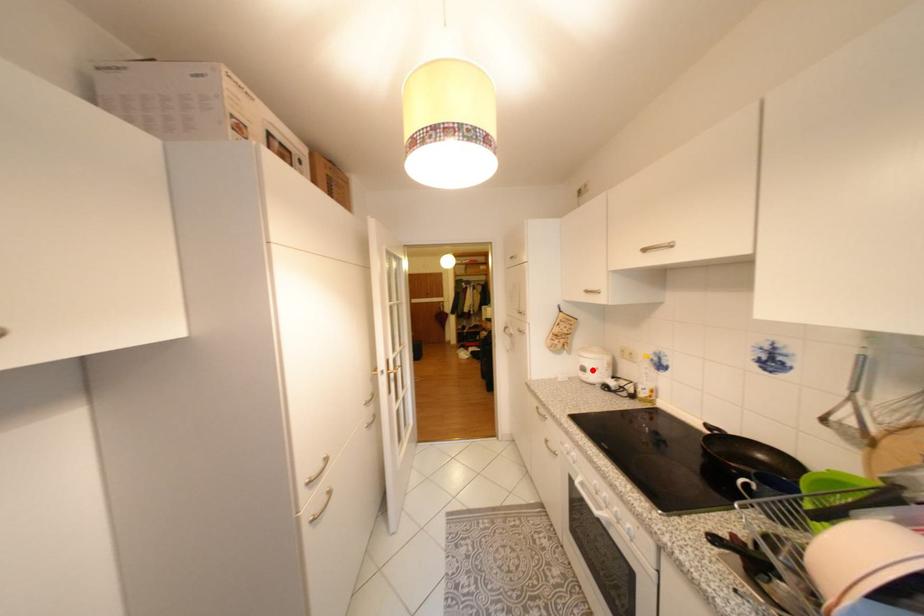
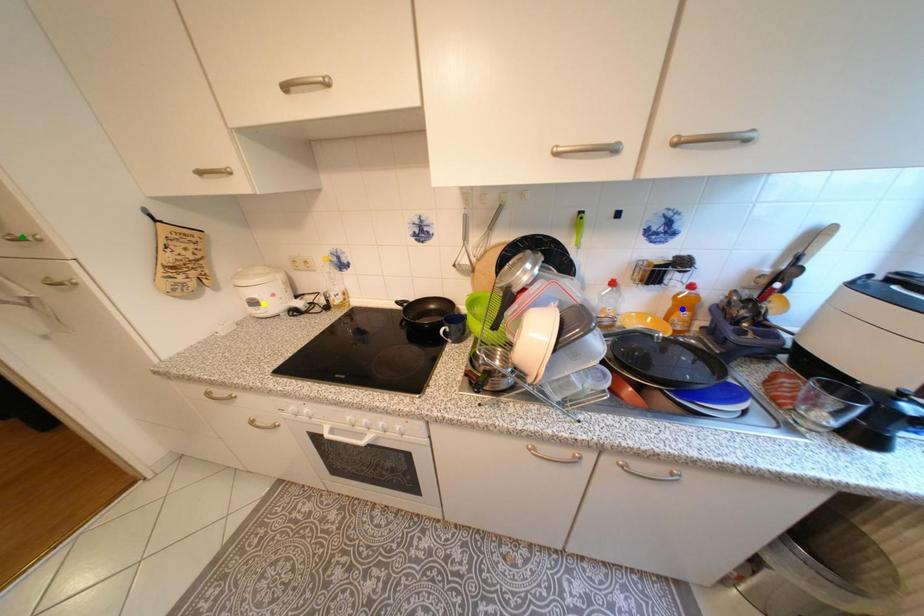
Question: I am providing you with two images of the same scene from different viewpoints. A red point is marked on the first image. You are given multiple points on the second image. Which point in image 2 represents the same 3d spot as the red point in image 1?

Choices:
 (A) green point
 (B) blue point
 (C) yellow point

Answer: (C)